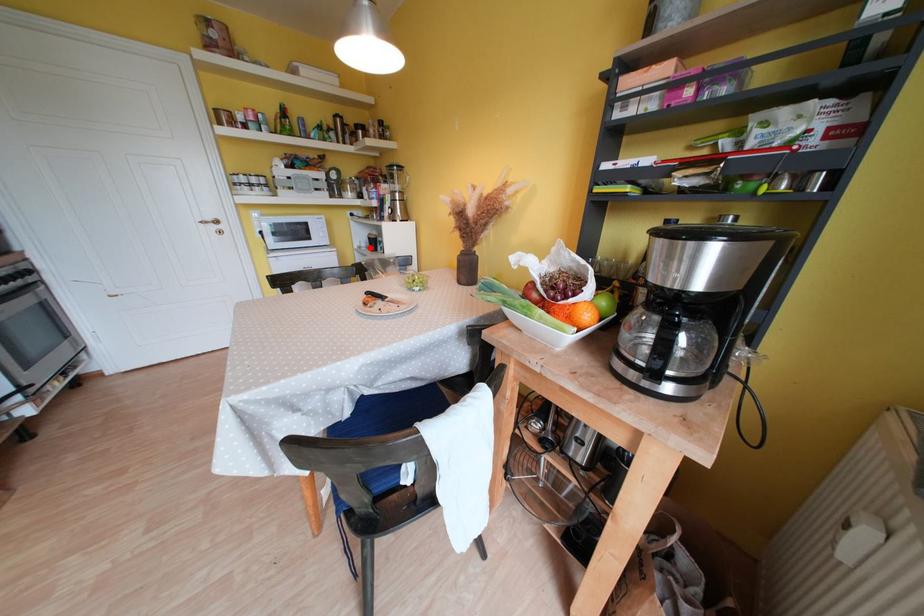
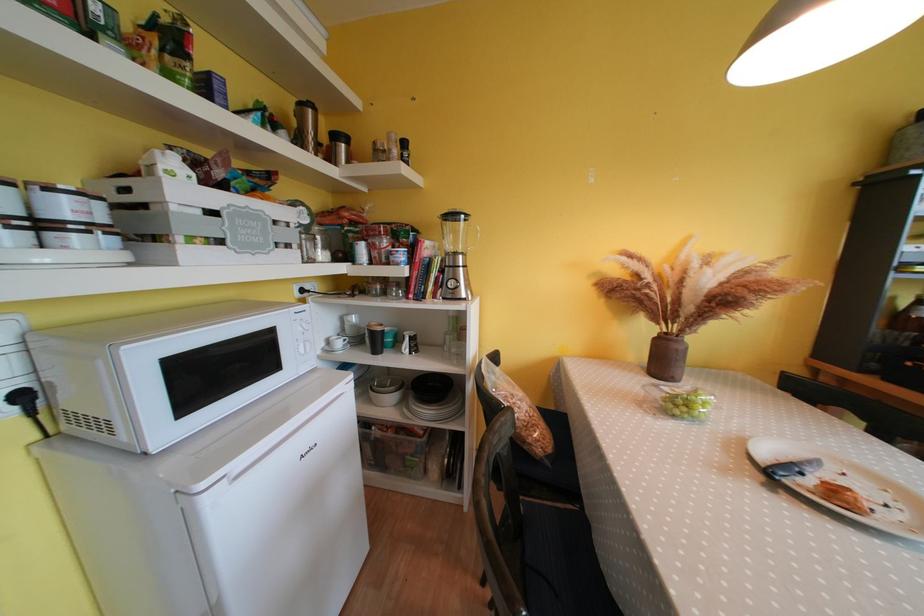
Locate, in the second image, the point that corresponds to the highlighted location in the first image.

(345, 347)